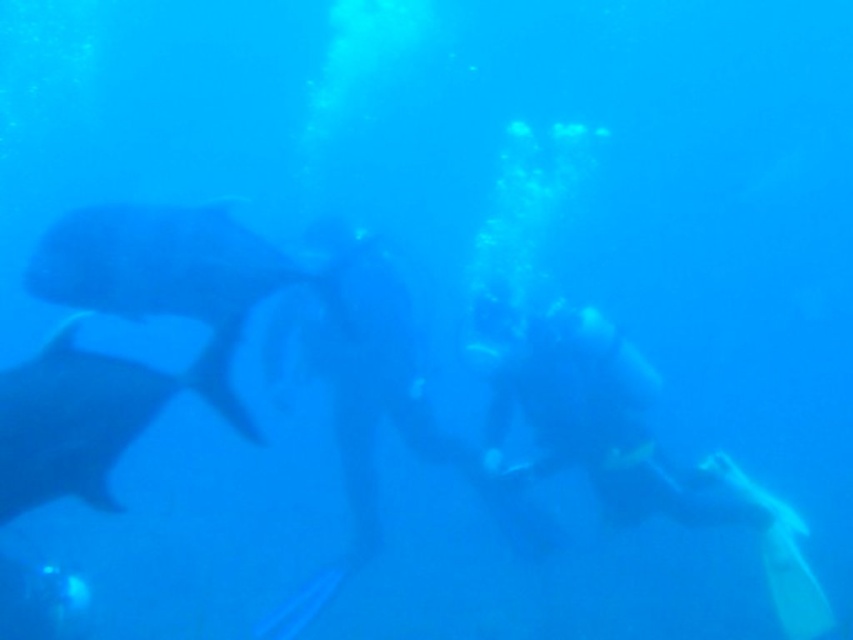
You are a marine biologist observing an underwater scene. You notice a smooth gray fish at left and a gray matte whale at left. Which of these two marine animals is larger in size?

The smooth gray fish at left is bigger than the gray matte whale at left.

You are a scuba diver who just lost your fins. You see a yellow rubber fins at right at point (625, 438). Can you reach them from your current position at point 0.45, 0.6?

The yellow rubber fins at right are located at point (625, 438). Since your current position is at 0.45, 0.6, you can swim towards the right and upwards to reach them.

Based on the photo, you are a marine biologist observing underwater life. You notice a smooth gray fish at left and a gray matte whale at left. Which one is closer to the surface?

The smooth gray fish at left is positioned over the gray matte whale at left, so it is closer to the surface.